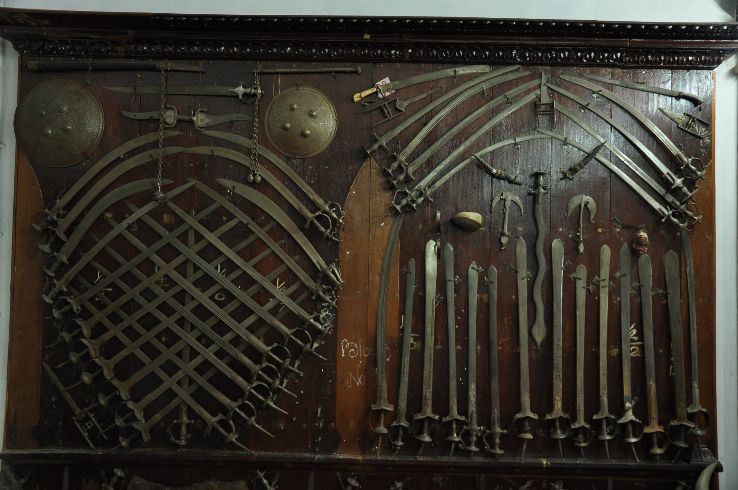
Where is `wall`? This screenshot has height=490, width=738. wall is located at coordinates (727, 165).